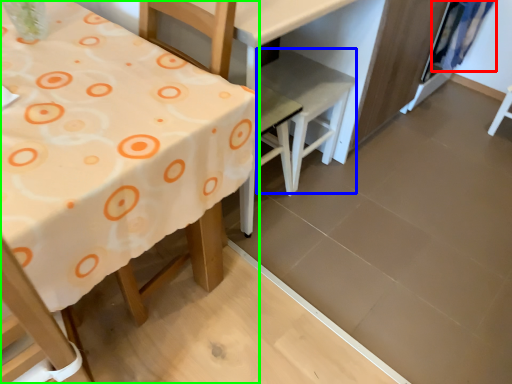
Question: Which object is the closest to the curtain (highlighted by a red box)? Choose among these: chair (highlighted by a blue box) or table (highlighted by a green box).

Choices:
 (A) chair
 (B) table

Answer: (A)